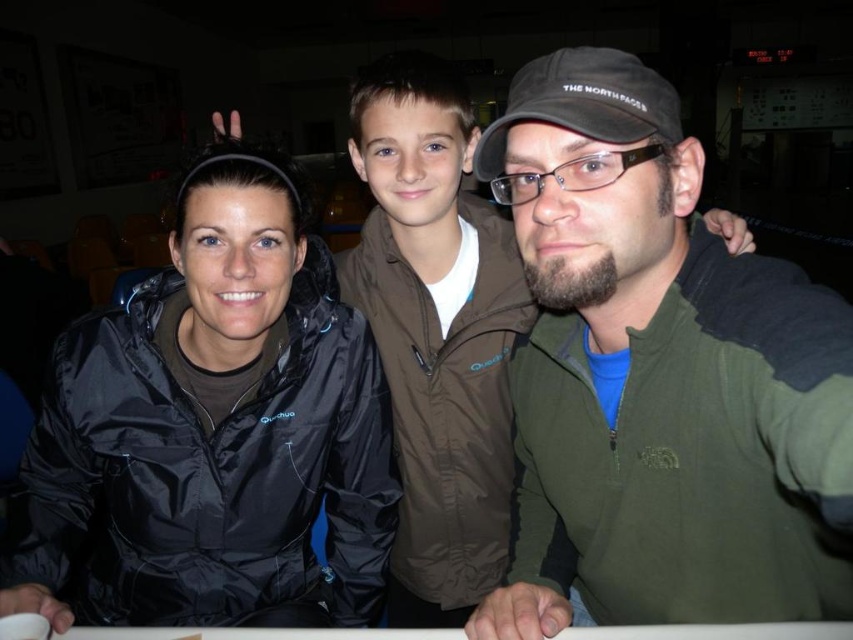
Question: Does green fleece jacket at center lie behind black matte jacket at center?

Choices:
 (A) no
 (B) yes

Answer: (A)

Question: Does green fleece jacket at center appear under black fabric baseball cap at center?

Choices:
 (A) no
 (B) yes

Answer: (B)

Question: Does green fleece jacket at center have a lesser width compared to black matte jacket at center?

Choices:
 (A) no
 (B) yes

Answer: (B)

Question: Which point appears closest to the camera in this image?

Choices:
 (A) (74, 576)
 (B) (598, 83)

Answer: (B)

Question: Which point is closer to the camera?

Choices:
 (A) (480, 179)
 (B) (641, 76)

Answer: (B)

Question: Estimate the real-world distances between objects in this image. Which object is closer to the black matte jacket at center?

Choices:
 (A) green fleece jacket at center
 (B) black fabric baseball cap at center

Answer: (A)